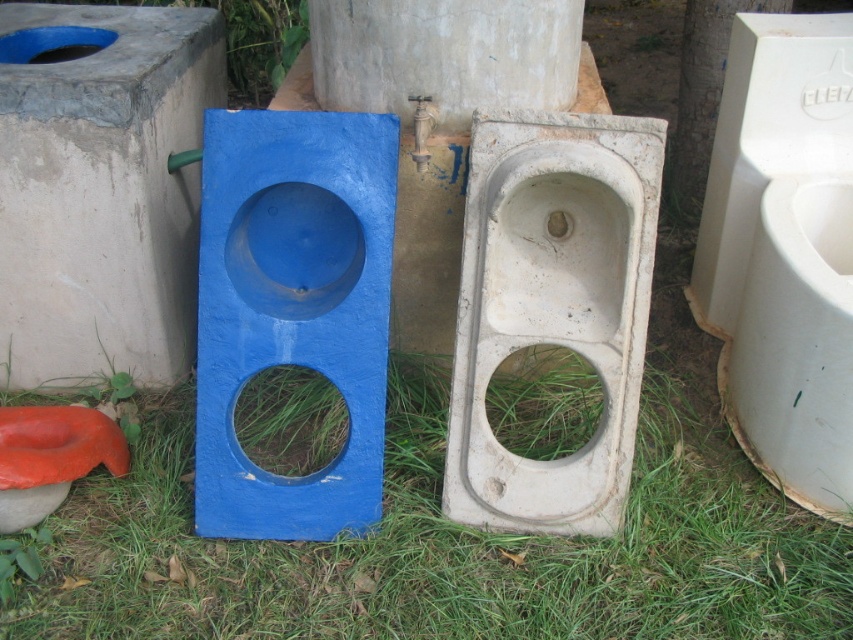
Can you confirm if green grass at center is bigger than white plastic urinal at right?

Yes, green grass at center is bigger than white plastic urinal at right.

Consider the image. Does green grass at center appear on the left side of white plastic urinal at right?

Yes, green grass at center is to the left of white plastic urinal at right.

Does point (811, 557) lie behind point (769, 224)?

No, (811, 557) is in front of (769, 224).

Identify the location of green grass at center. (444, 548).

Is white concrete urinal at center above white plastic urinal at right?

No.

Who is more forward, (518,524) or (830,154)?

Point (518,524)

Is point (637, 268) positioned after point (734, 173)?

No, (637, 268) is in front of (734, 173).

In order to click on white concrete urinal at center in this screenshot , I will do `click(552, 307)`.

Between green grass at center and white concrete urinal at center, which one appears on the right side from the viewer's perspective?

From the viewer's perspective, white concrete urinal at center appears more on the right side.

Is point (262, 426) behind point (468, 524)?

Yes, it is behind point (468, 524).

Between point (660, 387) and point (447, 428), which one is positioned behind?

The point (660, 387) is more distant.

Find the location of a particular element. This screenshot has width=853, height=640. green grass at center is located at coordinates (444, 548).